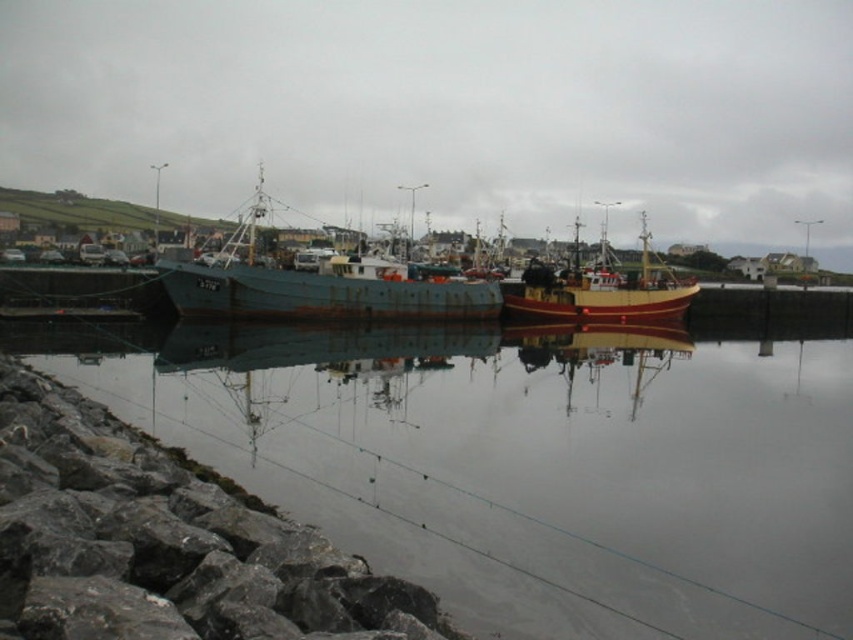
You are standing at the edge of the harbor and want to place a small potted plant between the gray rock at lower left and the wooden boat at center. Which object should the plant be closer to if you want it to be near the smaller object?

The gray rock at lower left is smaller than the wooden boat at center, so the plant should be placed closer to the gray rock at lower left.

You are standing at the edge of the harbor and want to walk from the gray rock at lower left to the wooden boat at center. Is the path between them clear of obstacles?

The gray rock at lower left is closer to the viewer than the wooden boat at center, so the path between them is clear of obstacles.

You are standing at the edge of the harbor and want to see your reflection in the water. Which object between the smooth reflective water at center and the gray rock at lower left would allow you to see your reflection?

The smooth reflective water at center is much taller than the gray rock at lower left, so you can see your reflection in the smooth reflective water at center.